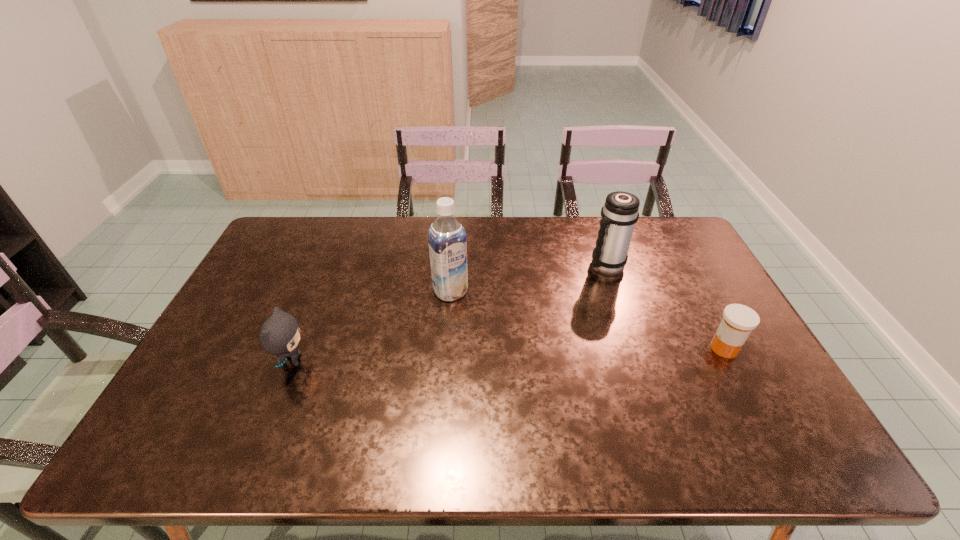
This screenshot has height=540, width=960. In order to click on kitten in this screenshot , I will do `click(280, 334)`.

Where is `the leftmost object`? The image size is (960, 540). the leftmost object is located at coordinates (280, 334).

Locate an element on the screen. The image size is (960, 540). the shortest object is located at coordinates (738, 321).

Identify the location of medicine. The image size is (960, 540). (738, 321).

Locate an element on the screen. This screenshot has height=540, width=960. the third nearest object is located at coordinates (447, 239).

Where is `the tallest object`? The image size is (960, 540). the tallest object is located at coordinates (447, 239).

Locate an element on the screen. This screenshot has width=960, height=540. the farthest object is located at coordinates (619, 214).

Where is `the third shortest object`? The height and width of the screenshot is (540, 960). the third shortest object is located at coordinates (619, 214).

Find the location of a particular element. This screenshot has width=960, height=540. free space located 0.270m on the front-facing side of the kitten is located at coordinates (409, 361).

What are the coordinates of `free space located on the label of the rightmost object` in the screenshot? It's located at (757, 349).